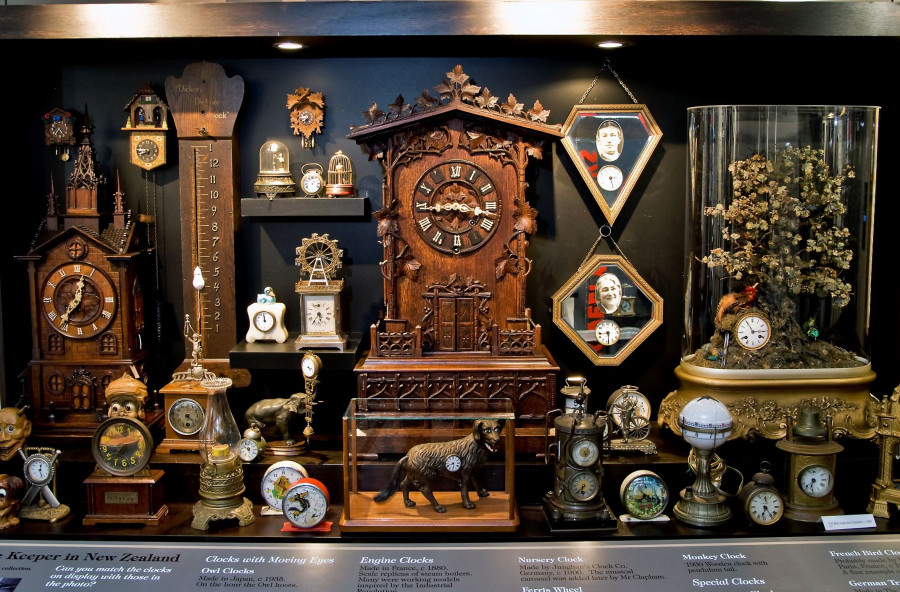
In order to click on museum display labels in this screenshot , I will do `click(55, 550)`, `click(230, 553)`, `click(409, 563)`, `click(580, 567)`, `click(707, 554)`, `click(858, 546)`, `click(866, 577)`, `click(730, 581)`, `click(544, 587)`.